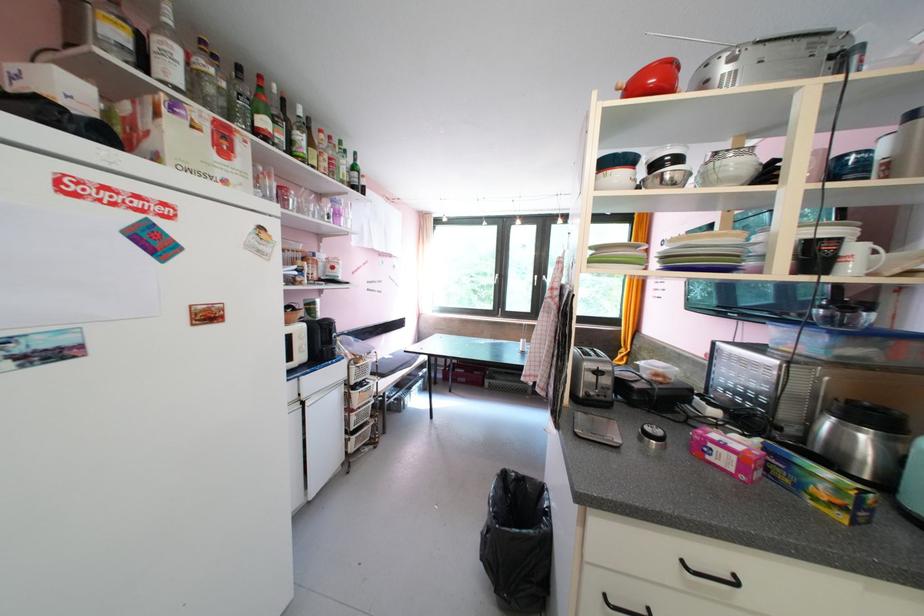
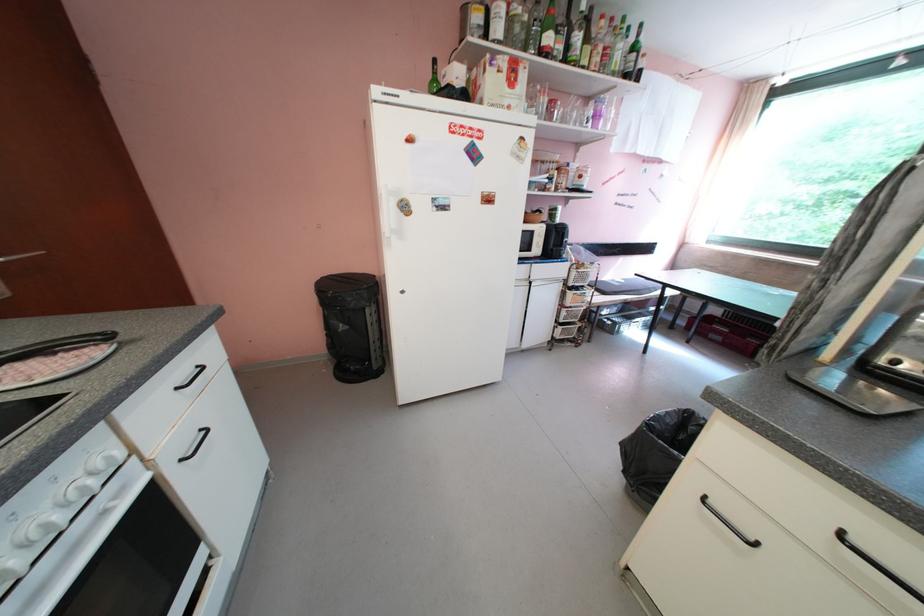
First-person continuous shooting, in which direction is the camera rotating?

The camera rotated toward left-down.